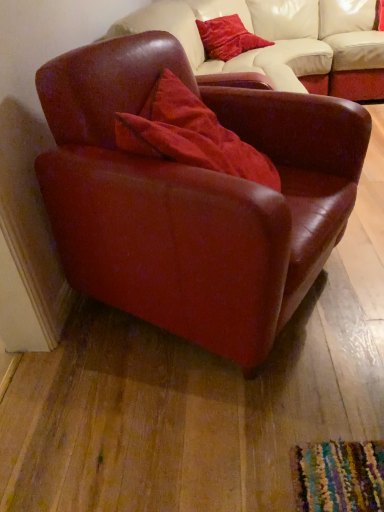
Question: In terms of size, does velvet red pillow at center, the 2th pillow when ordered from top to bottom, appear bigger or smaller than velvet red pillow at upper center, the first pillow positioned from the back?

Choices:
 (A) big
 (B) small

Answer: (A)

Question: Based on their positions, is velvet red pillow at center, the 2th pillow when ordered from top to bottom, located to the left or right of velvet red pillow at upper center, marked as the 2th pillow in a front-to-back arrangement?

Choices:
 (A) left
 (B) right

Answer: (A)

Question: Which object is positioned farthest from the velvet red pillow at upper center, which is counted as the first pillow, starting from the top?

Choices:
 (A) velvet red pillow at center, placed as the first pillow when sorted from front to back
 (B) matte leather armchair at center

Answer: (B)

Question: Estimate the real-world distances between objects in this image. Which object is closer to the matte leather armchair at center?

Choices:
 (A) velvet red pillow at upper center, the second pillow when ordered from bottom to top
 (B) velvet red pillow at center, the 2th pillow when ordered from top to bottom

Answer: (B)